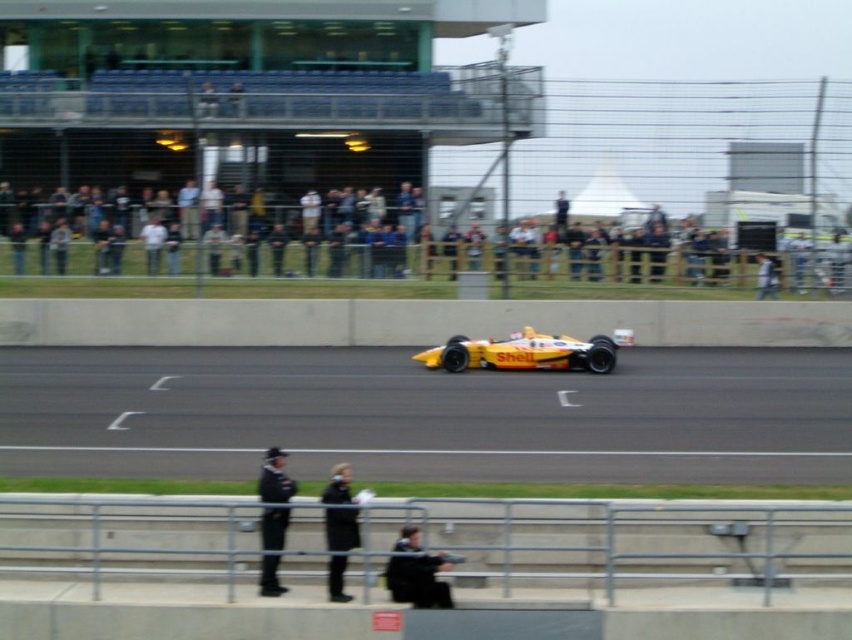
Does point (10, 388) come closer to viewer compared to point (810, 275)?

Yes.

Is yellow rubber race track at center smaller than yellow-orange racing car at center?

Actually, yellow rubber race track at center might be larger than yellow-orange racing car at center.

Is point (681, 451) behind point (26, 260)?

That is False.

This screenshot has height=640, width=852. In order to click on yellow rubber race track at center in this screenshot , I will do `click(427, 416)`.

Is point (320, 212) positioned before point (285, 508)?

That is False.

Consider the image. Can you confirm if yellow-orange racing car at center is thinner than uniformed officer at center?

In fact, yellow-orange racing car at center might be wider than uniformed officer at center.

At what (x,y) coordinates should I click in order to perform the action: click on yellow-orange racing car at center. Please return your answer as a coordinate pair (x, y). The image size is (852, 640). Looking at the image, I should click on (355, 248).

Does yellow matte race car at center appear under dark gray suit at center?

No.

Is point (515, 353) in front of point (433, 604)?

That is False.

Identify the location of yellow matte race car at center. Image resolution: width=852 pixels, height=640 pixels. (522, 353).